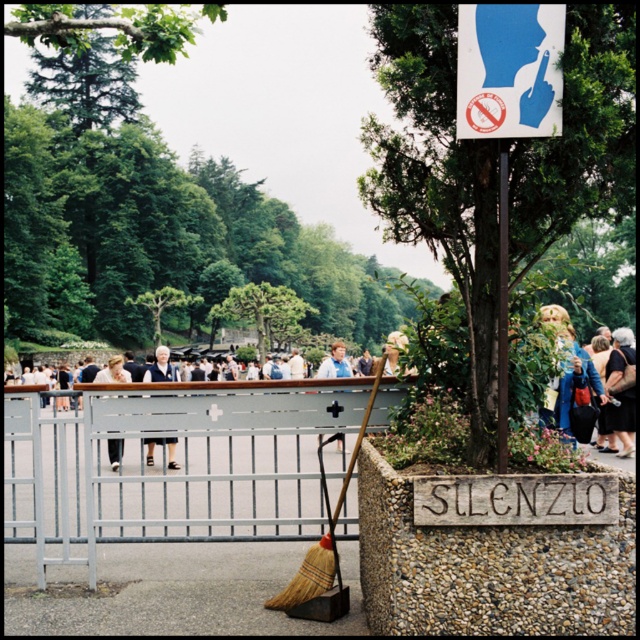
You are a visitor in the park and see the blue plastic sign at upper center and the light brown leather jacket at center. Which object takes up more space in the image?

The light brown leather jacket at center takes up more space in the image than the blue plastic sign at upper center because the blue plastic sign at upper center occupies less space than light brown leather jacket at center.

You are standing at the point labeled point (168, 468) in the image. What object is directly in front of you?

The point (168, 468) corresponds to the brushed metal fence at center, so the brushed metal fence at center is directly in front of you.